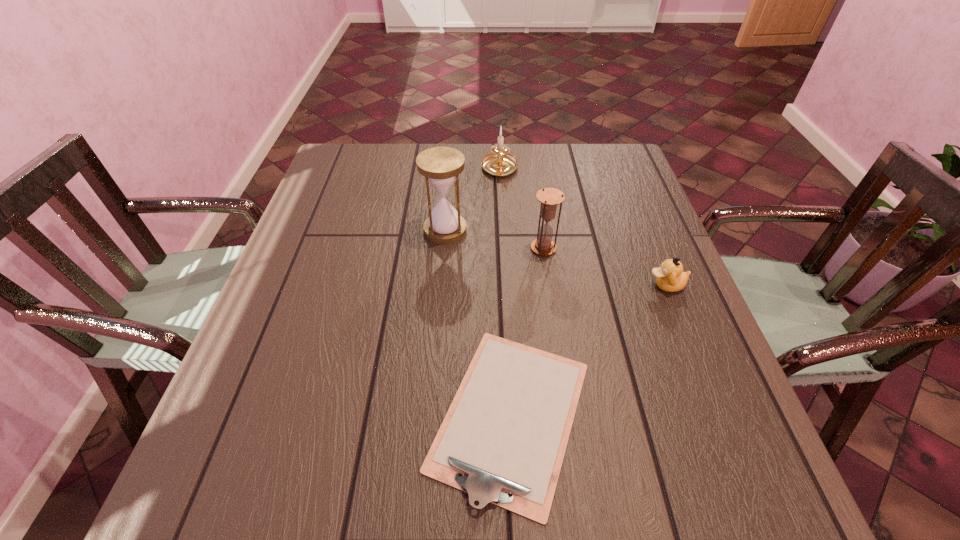
Locate an element on the screen. vacant space at the far edge of the desktop is located at coordinates (388, 177).

This screenshot has height=540, width=960. In the image, there is a desktop. In order to click on vacant area at the left edge in this screenshot , I will do `click(284, 272)`.

The width and height of the screenshot is (960, 540). In the image, there is a desktop. What are the coordinates of `vacant space at the right edge` in the screenshot? It's located at (737, 402).

Where is `free space at the far left corner of the desktop`? free space at the far left corner of the desktop is located at coordinates (341, 153).

Locate an element on the screen. vacant space at the far right corner is located at coordinates click(588, 159).

Image resolution: width=960 pixels, height=540 pixels. Identify the location of free space between the fourth shortest object and the clipboard. (527, 332).

Find the location of a particular element. This screenshot has height=540, width=960. free area in between the duckling and the nearest object is located at coordinates (588, 350).

You are a GUI agent. You are given a task and a screenshot of the screen. Output one action in this format:
    pyautogui.click(x=<x>, y=<y>)
    Task: Click on the vacant area that lies between the fourth shortest object and the fourth tallest object
    The height and width of the screenshot is (540, 960).
    Given the screenshot: What is the action you would take?
    pyautogui.click(x=605, y=267)

At what (x,y) coordinates should I click in order to perform the action: click on vacant point located between the tallest object and the second shortest object. Please return your answer as a coordinate pair (x, y). Looking at the image, I should click on (556, 258).

At what (x,y) coordinates should I click in order to perform the action: click on free space between the tallest object and the third shortest object. Please return your answer as a coordinate pair (x, y). This screenshot has height=540, width=960. Looking at the image, I should click on (472, 200).